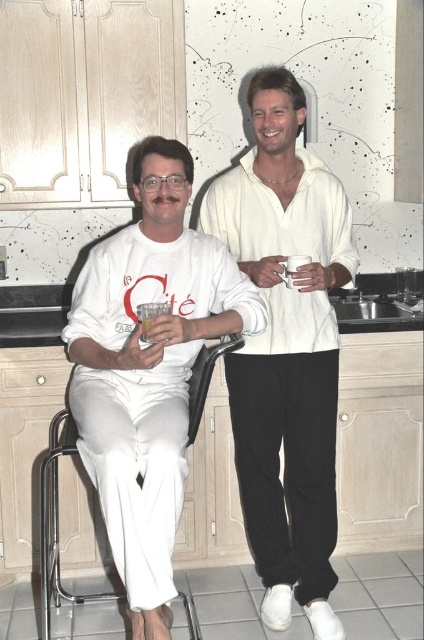
Question: Considering the relative positions of white matte shirt at center and white matte shirt at left in the image provided, where is white matte shirt at center located with respect to white matte shirt at left?

Choices:
 (A) right
 (B) left

Answer: (A)

Question: Is white matte shirt at left positioned at the back of translucent glass at left?

Choices:
 (A) no
 (B) yes

Answer: (A)

Question: Which point appears closest to the camera in this image?

Choices:
 (A) (204, 218)
 (B) (142, 321)

Answer: (B)

Question: Observing the image, what is the correct spatial positioning of white matte shirt at center in reference to white matte shirt at left?

Choices:
 (A) left
 (B) right

Answer: (B)

Question: Which point appears farthest from the camera in this image?

Choices:
 (A) (320, 636)
 (B) (153, 316)

Answer: (A)

Question: Which is farther from the translucent glass at left?

Choices:
 (A) white matte shirt at left
 (B) white matte shirt at center

Answer: (B)